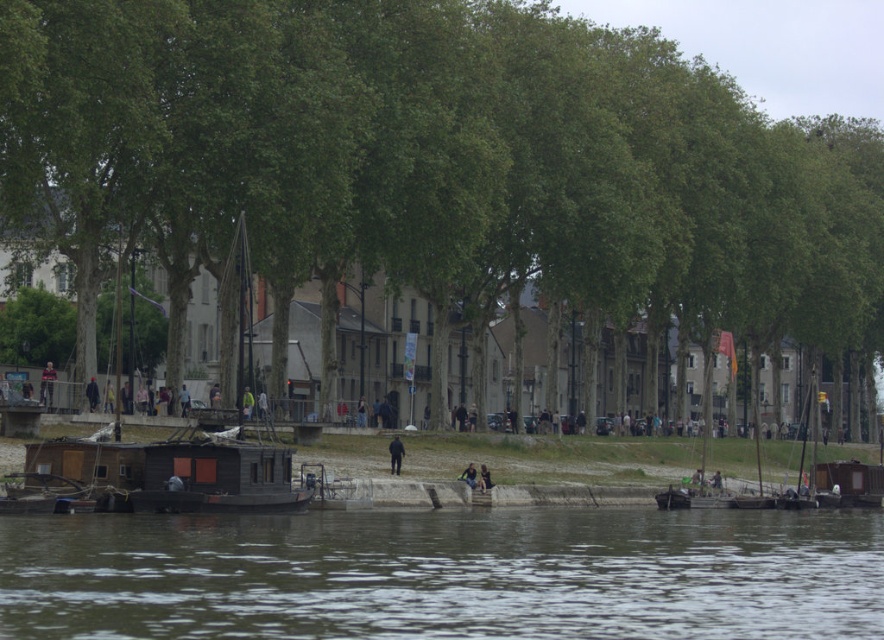
You are a tourist standing at the riverside and see the green leafy tree at center and the black matte pants at center. Which object is positioned to the right of the other?

The green leafy tree at center is to the right of black matte pants at center.

You are a tourist standing on the riverside path and see the brown water at lower center and the yellow fabric person at center. Which object appears taller from your perspective?

The brown water at lower center appears taller than the yellow fabric person at center because the description states that the brown water at lower center is much taller as yellow fabric person at center.

You are standing at the riverside and want to know which of the two points, point [652,625] or point [249,401], is closer to you. Can you determine this based on the scene?

Point [652,625] is closer to the viewer than point [249,401].